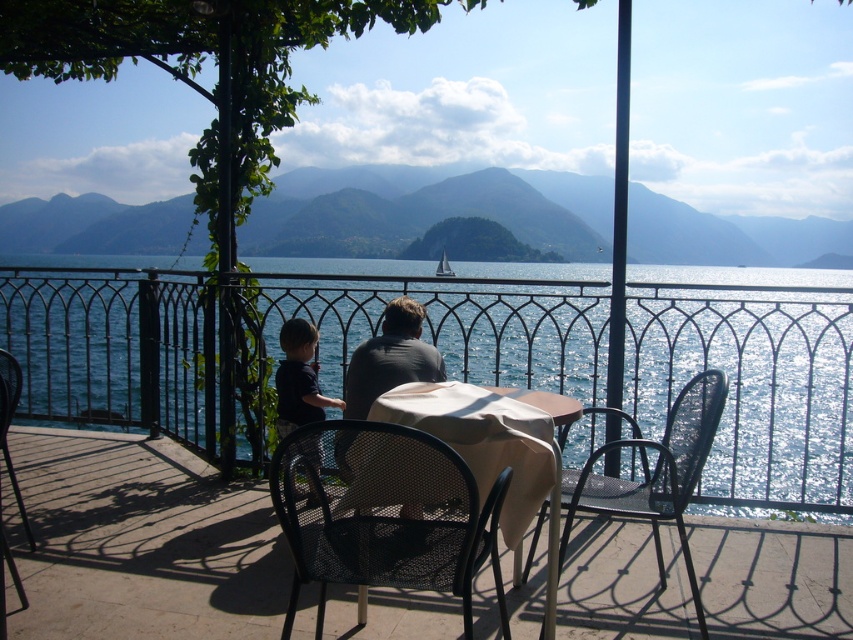
Question: Does dark blue shirt at lower left appear under black mesh chair at lower left?

Choices:
 (A) yes
 (B) no

Answer: (B)

Question: Which object is positioned closest to the black mesh chair at center?

Choices:
 (A) gray fabric shirt at center
 (B) metal mesh table at center
 (C) metallic black balcony at center
 (D) beige fabric-covered table at center

Answer: (D)

Question: Can you confirm if beige fabric-covered table at center is bigger than black metal chair at right?

Choices:
 (A) no
 (B) yes

Answer: (A)

Question: Which point is closer to the camera?

Choices:
 (A) (477, 456)
 (B) (405, 577)

Answer: (B)

Question: Which point is closer to the camera?

Choices:
 (A) (399, 557)
 (B) (386, 387)
 (C) (10, 365)

Answer: (A)

Question: Does black mesh chair at center appear under black metal chair at right?

Choices:
 (A) no
 (B) yes

Answer: (A)